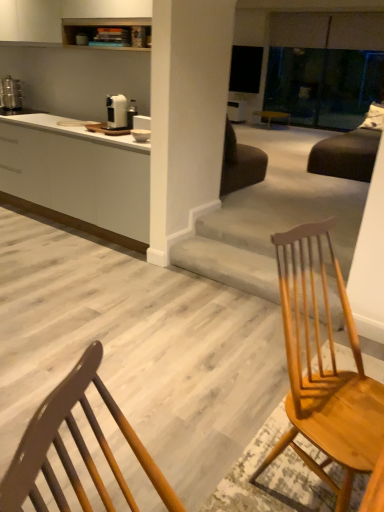
Question: From the image's perspective, is metallic silver toaster at left, marked as the second appliance in a right-to-left arrangement, above or below white matte cabinet at left?

Choices:
 (A) above
 (B) below

Answer: (A)

Question: Is metallic silver toaster at left, marked as the second appliance in a right-to-left arrangement, to the left or to the right of white matte cabinet at left in the image?

Choices:
 (A) left
 (B) right

Answer: (A)

Question: Which of these objects is positioned farthest from the white matte cabinet at left?

Choices:
 (A) light brown wood chair at center
 (B) satin silver toaster at upper center, the second appliance viewed from the top
 (C) metallic silver toaster at left, marked as the second appliance in a bottom-to-top arrangement

Answer: (A)

Question: Estimate the real-world distances between objects in this image. Which object is farther from the satin silver toaster at upper center, the second appliance viewed from the top?

Choices:
 (A) white matte cabinet at left
 (B) metallic silver toaster at left, arranged as the 2th appliance when viewed from the front
 (C) light brown wood chair at center

Answer: (C)